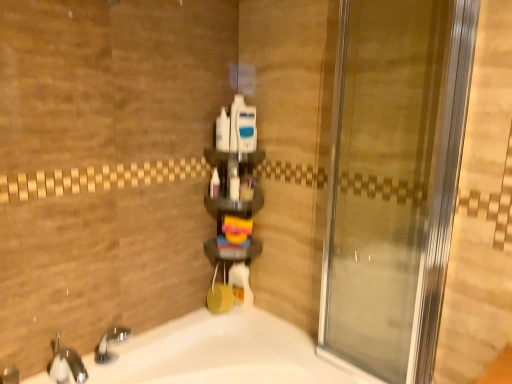
The image size is (512, 384). Find the location of `vacant point above translucent plastic shelf at center (from a real-world perspective)`. vacant point above translucent plastic shelf at center (from a real-world perspective) is located at coordinates (234, 152).